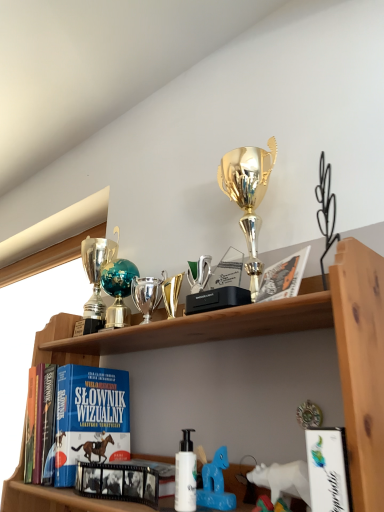
Question: From a real-world perspective, is shiny silver trophy at center, which appears as the 2th toy when viewed from the back, above or below white glossy book at lower right, which is the third book in left-to-right order?

Choices:
 (A) above
 (B) below

Answer: (A)

Question: Is shiny silver trophy at center, which appears as the second toy when viewed from the right, to the left or to the right of white glossy book at lower right, the first book from the right, in the image?

Choices:
 (A) right
 (B) left

Answer: (B)

Question: Which of these objects is positioned closest to the white glossy book at lower right, the 1th book viewed from the front?

Choices:
 (A) white matte bottle at center
 (B) black glossy film strip at center, the second book viewed from the right
 (C) teal glass globe at upper center, which is counted as the second toy, starting from the top
 (D) white plastic toy horse at lower center, marked as the 1th toy in a bottom-to-top arrangement
 (E) blue hardcover book at lower left, the third book positioned from the right

Answer: (D)

Question: Estimate the real-world distances between objects in this image. Which object is farther from the black glossy film strip at center, which is counted as the second book, starting from the back?

Choices:
 (A) blue hardcover book at lower left, the third book positioned from the right
 (B) teal glass globe at upper center, which ranks as the 2th toy in bottom-to-top order
 (C) shiny silver trophy at center, which is counted as the third toy, starting from the bottom
 (D) white plastic toy horse at lower center, the first toy positioned from the front
 (E) white matte bottle at center

Answer: (C)